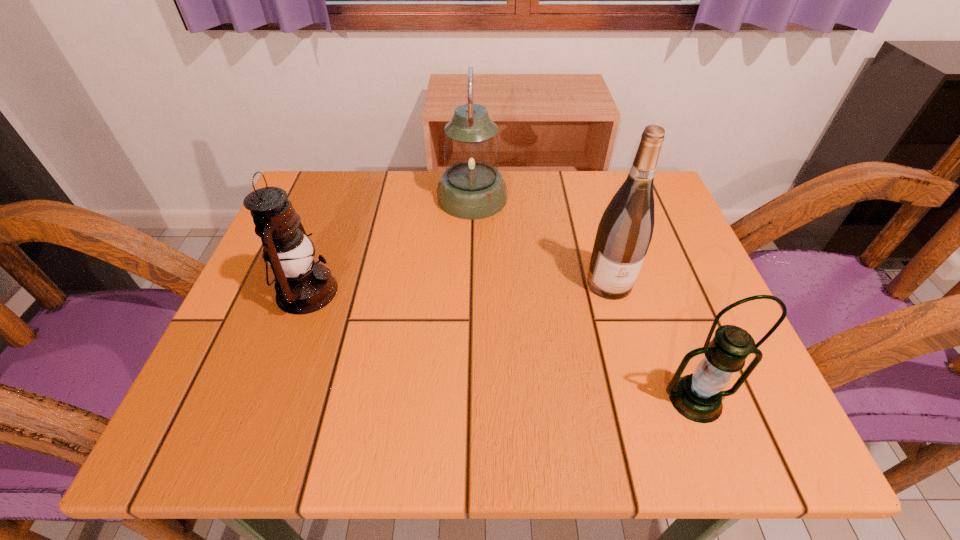
Identify the location of wine bottle. The height and width of the screenshot is (540, 960). (624, 233).

Where is `the farthest lantern`? The width and height of the screenshot is (960, 540). the farthest lantern is located at coordinates (471, 188).

This screenshot has width=960, height=540. I want to click on the farthest object, so click(x=471, y=188).

Where is `the leftmost object`? The width and height of the screenshot is (960, 540). the leftmost object is located at coordinates (287, 248).

I want to click on the second nearest lantern, so click(287, 248).

Where is `the rightmost lantern`? This screenshot has width=960, height=540. the rightmost lantern is located at coordinates (698, 397).

In order to click on the nearest lantern in this screenshot , I will do `click(698, 397)`.

Identify the location of vacant space located on the label of the wine bottle. Image resolution: width=960 pixels, height=540 pixels. (655, 444).

Identify the location of vacant space located 0.060m on the right of the farthest lantern. The image size is (960, 540). (532, 198).

At what (x,y) coordinates should I click in order to perform the action: click on free location located 0.150m on the side of the second nearest lantern, there is a wick adjustment knob. Please return your answer as a coordinate pair (x, y). Looking at the image, I should click on (414, 292).